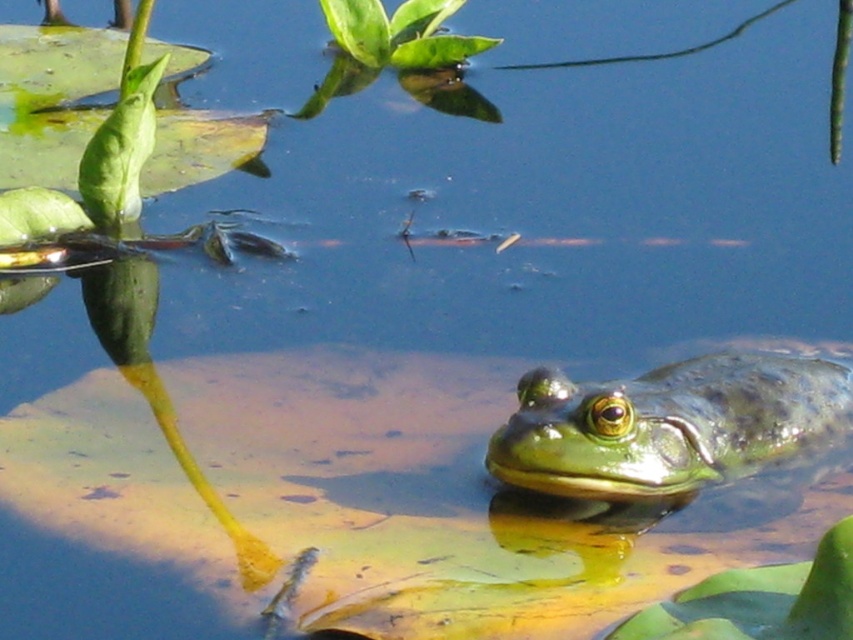
You are a photographer aiming to capture the green rough skin frog at lower right and the green leafy plant at upper center in the same frame. Based on their positions, which object should you adjust your camera to focus on first if you want to include both in your shot?

The green rough skin frog at lower right is to the right of the green leafy plant at upper center, so you should focus on the green leafy plant at upper center first to ensure both are in frame.

You are standing on a wooden dock and see the green rough skin frog at lower right in the water. If you want to reach the frog with a 1.5 meter long fishing net, will you be able to do so?

The green rough skin frog at lower right is 1.59 meters away from viewer. Since the fishing net is only 1.5 meters long, you cannot reach the frog as the distance is slightly longer than the net.

You are a photographer trying to capture the green rough skin frog at lower right without the green leafy plant at upper center blocking the view. Can you adjust your position to do so?

The green rough skin frog at lower right is in front of the green leafy plant at upper center, so you can move your position slightly to the side to avoid the plant blocking the frog.